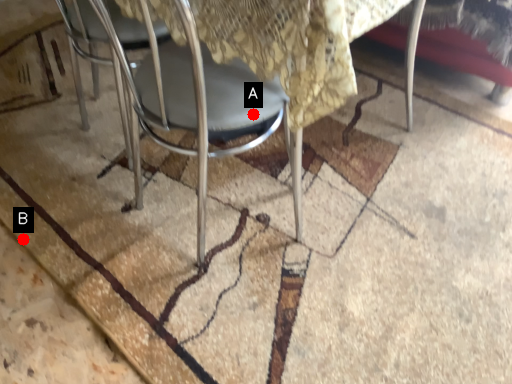
Question: Two points are circled on the image, labeled by A and B beside each circle. Which point is farther to the camera?

Choices:
 (A) A is further
 (B) B is further

Answer: (B)